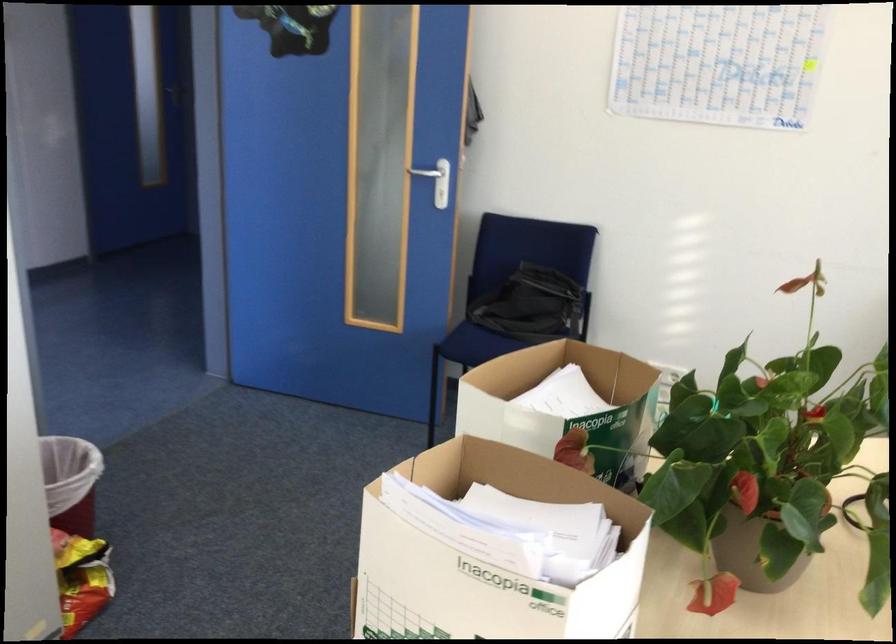
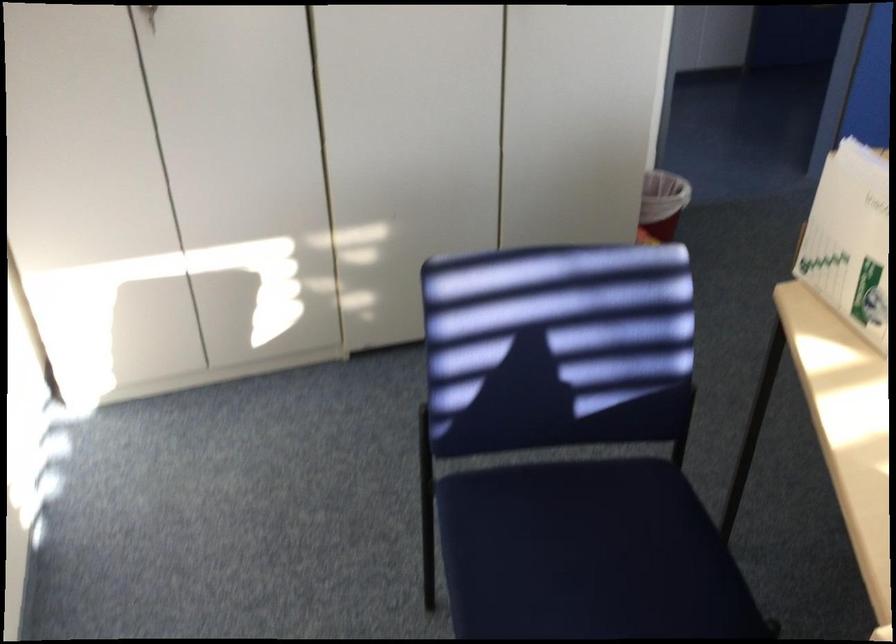
Find the pixel in the second image that matches pixel 96 502 in the first image.

(661, 203)